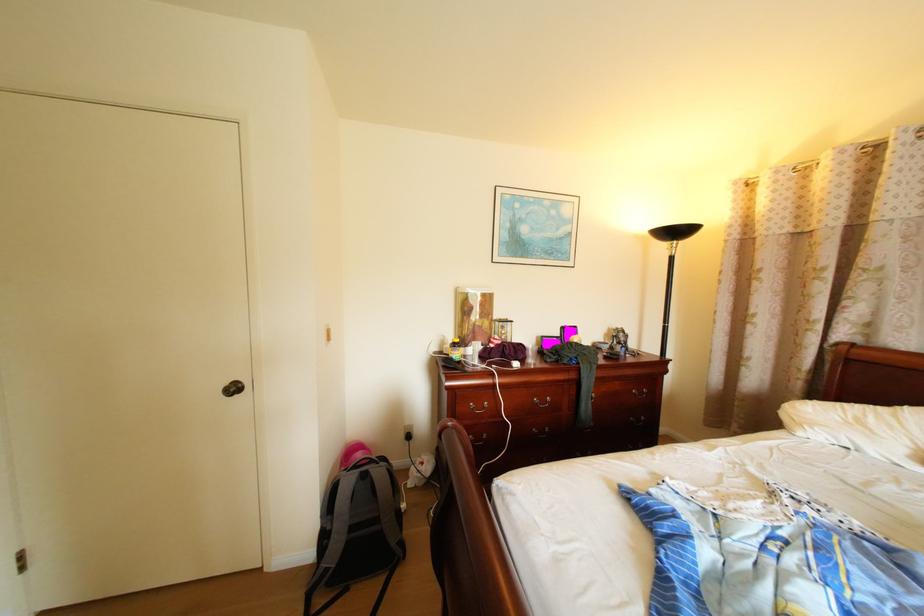
This screenshot has width=924, height=616. Identify the location of yellow bottle. (455, 350).